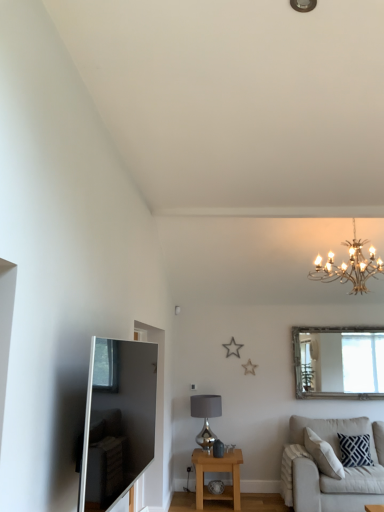
Question: Does silver-framed mirror at upper right have a smaller size compared to silver metallic lampshade at center?

Choices:
 (A) no
 (B) yes

Answer: (A)

Question: Is silver-framed mirror at upper right facing towards silver metallic lampshade at center?

Choices:
 (A) no
 (B) yes

Answer: (A)

Question: Is silver-framed mirror at upper right located outside silver metallic lampshade at center?

Choices:
 (A) yes
 (B) no

Answer: (A)

Question: Is silver-framed mirror at upper right far from silver metallic lampshade at center?

Choices:
 (A) yes
 (B) no

Answer: (A)

Question: From a real-world perspective, is silver-framed mirror at upper right on top of silver metallic lampshade at center?

Choices:
 (A) yes
 (B) no

Answer: (A)

Question: Is light beige fabric couch at lower right to the left or to the right of light oak wooden side table at lower center in the image?

Choices:
 (A) left
 (B) right

Answer: (B)

Question: Is light beige fabric couch at lower right wider or thinner than light oak wooden side table at lower center?

Choices:
 (A) wide
 (B) thin

Answer: (A)

Question: From the image's perspective, is light beige fabric couch at lower right located above or below light oak wooden side table at lower center?

Choices:
 (A) below
 (B) above

Answer: (B)

Question: From a real-world perspective, is light beige fabric couch at lower right physically located above or below light oak wooden side table at lower center?

Choices:
 (A) below
 (B) above

Answer: (B)

Question: Looking at their shapes, would you say navy blue textured pillow at lower right is wider or thinner than silver metallic lampshade at center?

Choices:
 (A) wide
 (B) thin

Answer: (B)

Question: Is navy blue textured pillow at lower right taller or shorter than silver metallic lampshade at center?

Choices:
 (A) short
 (B) tall

Answer: (A)

Question: From the image's perspective, is navy blue textured pillow at lower right positioned above or below silver metallic lampshade at center?

Choices:
 (A) below
 (B) above

Answer: (A)

Question: From a real-world perspective, is navy blue textured pillow at lower right physically located above or below silver metallic lampshade at center?

Choices:
 (A) above
 (B) below

Answer: (B)

Question: Relative to silver metallic lampshade at center, is light oak wooden side table at lower center in front or behind?

Choices:
 (A) behind
 (B) front

Answer: (B)

Question: Does point (228, 487) appear closer or farther from the camera than point (205, 425)?

Choices:
 (A) closer
 (B) farther

Answer: (A)